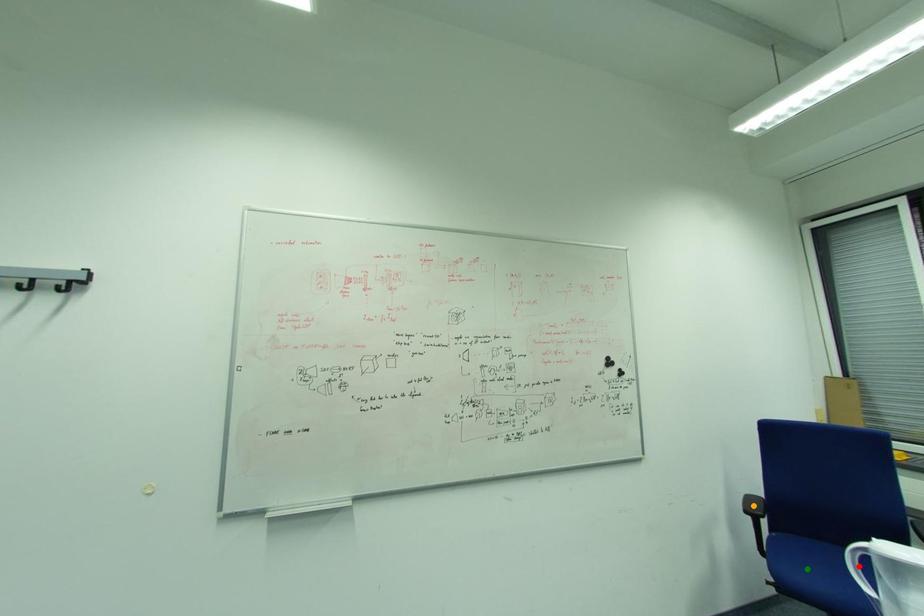
Order these from nearest to farthest:
1. red point
2. green point
3. orange point

red point
green point
orange point